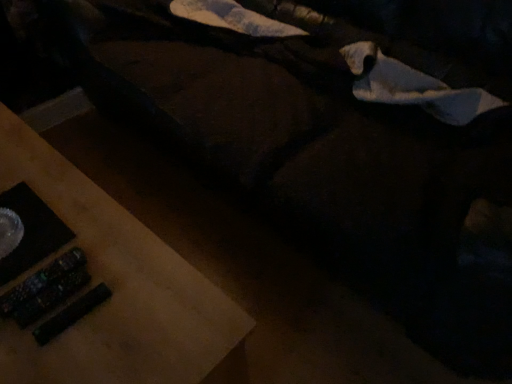
Where is `empty space that is ontop of wooden table at lower left (from a real-world perspective)`? The height and width of the screenshot is (384, 512). empty space that is ontop of wooden table at lower left (from a real-world perspective) is located at coordinates (62, 246).